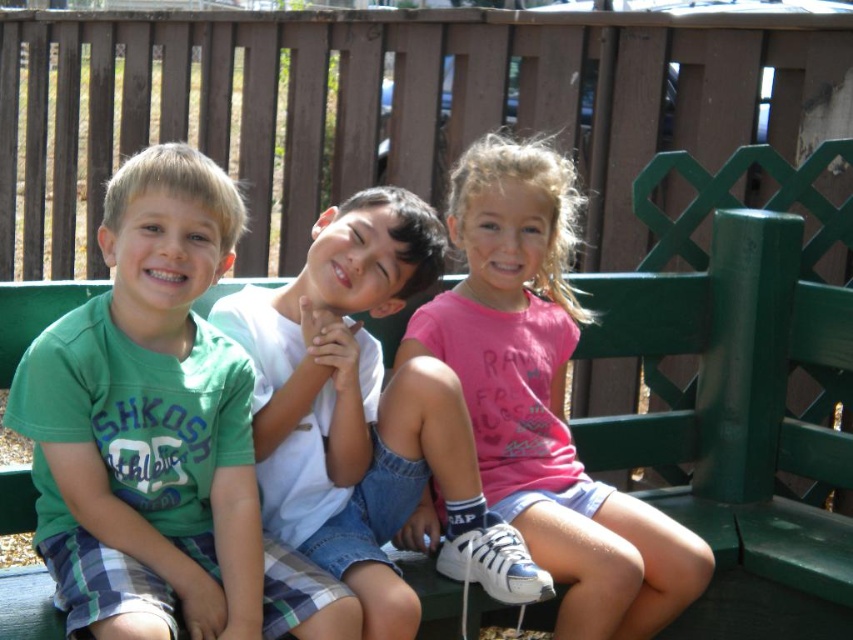
Question: Which object is positioned farthest from the green wood bench at center?

Choices:
 (A) pink cotton shirt at center
 (B) white cotton shirt at center
 (C) green cotton shirt at left

Answer: (C)

Question: Does green cotton shirt at left have a smaller size compared to pink cotton shirt at center?

Choices:
 (A) no
 (B) yes

Answer: (B)

Question: Can you confirm if green cotton shirt at left is bigger than white cotton shirt at center?

Choices:
 (A) no
 (B) yes

Answer: (A)

Question: Among these objects, which one is nearest to the camera?

Choices:
 (A) pink cotton shirt at center
 (B) green cotton shirt at left
 (C) green wood bench at center

Answer: (B)

Question: Which of the following is the closest to the observer?

Choices:
 (A) white cotton shirt at center
 (B) green cotton shirt at left
 (C) pink cotton shirt at center
 (D) green wood bench at center

Answer: (B)

Question: Observing the image, what is the correct spatial positioning of green cotton shirt at left in reference to pink cotton shirt at center?

Choices:
 (A) above
 (B) below

Answer: (A)